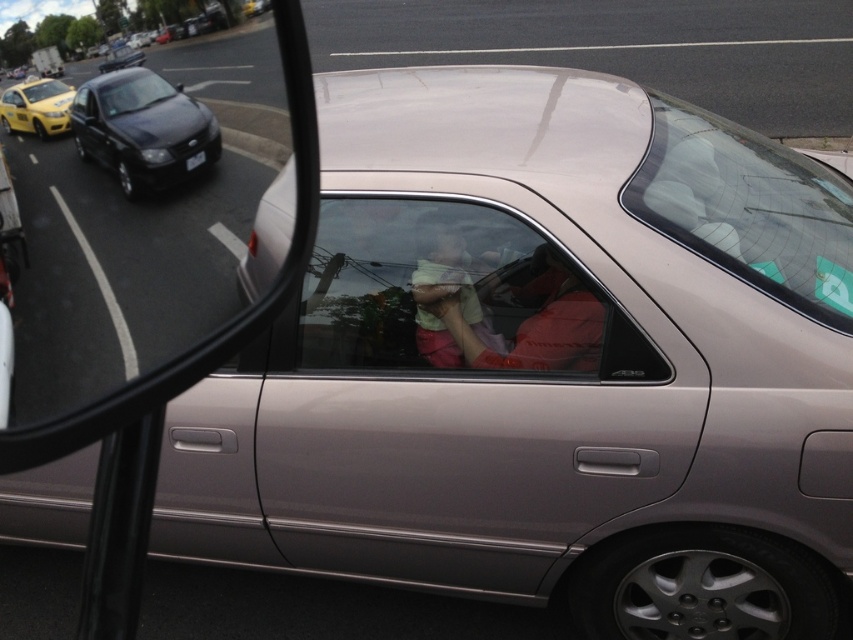
Who is taller, clear glass window at center or light green fabric at center?

clear glass window at center is taller.

Is clear glass window at center further to the viewer compared to light green fabric at center?

No, clear glass window at center is in front of light green fabric at center.

At what (x,y) coordinates should I click in order to perform the action: click on clear glass window at center. Please return your answer as a coordinate pair (x, y). This screenshot has width=853, height=640. Looking at the image, I should click on (456, 296).

Does point (769, 253) come behind point (198, 150)?

Yes, point (769, 253) is farther from viewer.

This screenshot has height=640, width=853. What do you see at coordinates (747, 208) in the screenshot?
I see `clear glass windshield at upper center` at bounding box center [747, 208].

Which is behind, point (743, 257) or point (198, 152)?

The point (743, 257) is more distant.

You are a GUI agent. You are given a task and a screenshot of the screen. Output one action in this format:
    pyautogui.click(x=<x>, y=<y>)
    Task: Click on the clear glass windshield at upper center
    Image resolution: width=853 pixels, height=640 pixels.
    Given the screenshot: What is the action you would take?
    pyautogui.click(x=747, y=208)

Does point (135, 355) come farther from viewer compared to point (448, 246)?

That is False.

Between clear glass mirror at center and light green fabric at center, which one appears on the right side from the viewer's perspective?

From the viewer's perspective, light green fabric at center appears more on the right side.

Is point (283, 33) positioned after point (444, 266)?

No, (283, 33) is in front of (444, 266).

Locate an element on the screen. The image size is (853, 640). clear glass mirror at center is located at coordinates (154, 230).